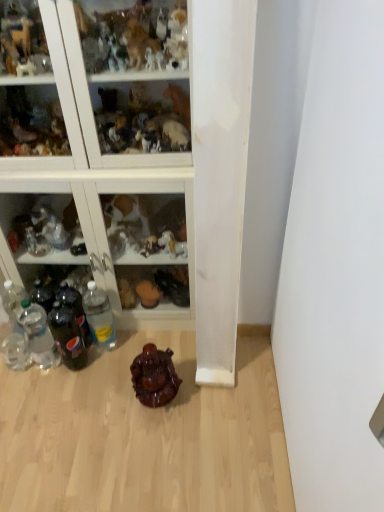
You are a GUI agent. You are given a task and a screenshot of the screen. Output one action in this format:
    pyautogui.click(x=<x>, y=<y>)
    Task: Click on the vacant region in front of clear plastic bottles at left, the fifth bottle positioned from the right
    The height and width of the screenshot is (512, 384).
    Given the screenshot: What is the action you would take?
    pyautogui.click(x=23, y=393)